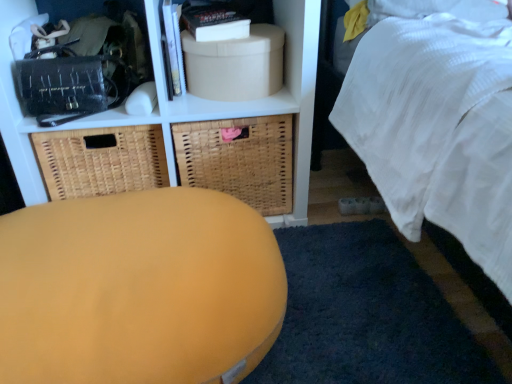
Based on the photo, in order to face woven brown basket at left, the 2th basket positioned from the right, should I rotate leftwards or rightwards?

To align with it, rotate left about 18.414°.

What do you see at coordinates (366, 315) in the screenshot?
I see `soft blue carpet at lower center` at bounding box center [366, 315].

The width and height of the screenshot is (512, 384). What do you see at coordinates (138, 289) in the screenshot? I see `matte yellow ottoman at center` at bounding box center [138, 289].

What is the approximate width of woven brown basket at center, the first basket viewed from the right?

woven brown basket at center, the first basket viewed from the right, is 36.87 centimeters in width.

At what (x,y) coordinates should I click in order to perform the action: click on woven brown basket at left, the first basket in the left-to-right sequence. Please return your answer as a coordinate pair (x, y). The image size is (512, 384). Looking at the image, I should click on (101, 160).

Is matte yellow ottoman at center not within woven brown basket at left, the 2th basket positioned from the right?

That's correct, matte yellow ottoman at center is outside of woven brown basket at left, the 2th basket positioned from the right.

Is point (117, 211) positioned in front of point (76, 131)?

Yes, it is.

Which of these two, matte yellow ottoman at center or woven brown basket at left, the 2th basket positioned from the right, is smaller?

With smaller size is woven brown basket at left, the 2th basket positioned from the right.

Which of these two, matte black book at upper center or woven brown basket at left, the 2th basket positioned from the right, stands shorter?

matte black book at upper center is shorter.

Considering the positions of point (234, 28) and point (51, 150), is point (234, 28) closer or farther from the camera than point (51, 150)?

Clearly, point (234, 28) is more distant from the camera than point (51, 150).

From the picture: Is matte black book at upper center facing towards woven brown basket at left, the first basket in the left-to-right sequence?

No, matte black book at upper center is not aimed at woven brown basket at left, the first basket in the left-to-right sequence.

Is matte black book at upper center located outside woven brown basket at left, the first basket in the left-to-right sequence?

Absolutely, matte black book at upper center is external to woven brown basket at left, the first basket in the left-to-right sequence.

Is woven brown basket at left, the 2th basket positioned from the right, not within matte white shelf at upper center?

That's incorrect, woven brown basket at left, the 2th basket positioned from the right, is not completely outside matte white shelf at upper center.

From a real-world perspective, is woven brown basket at left, the first basket in the left-to-right sequence, physically below matte white shelf at upper center?

Yes, from a real-world perspective, woven brown basket at left, the first basket in the left-to-right sequence, is beneath matte white shelf at upper center.

Which is more to the right, woven brown basket at left, the first basket in the left-to-right sequence, or matte white shelf at upper center?

Positioned to the right is matte white shelf at upper center.

Does woven brown basket at left, the first basket in the left-to-right sequence, have a greater width compared to matte white shelf at upper center?

Incorrect, the width of woven brown basket at left, the first basket in the left-to-right sequence, does not surpass that of matte white shelf at upper center.

How many degrees apart are the facing directions of matte white shelf at upper center and beige cardboard box at upper center?

The angle between the facing direction of matte white shelf at upper center and the facing direction of beige cardboard box at upper center is 3.93 degrees.

From the image's perspective, is matte white shelf at upper center below beige cardboard box at upper center?

Yes, from the image's perspective, matte white shelf at upper center is beneath beige cardboard box at upper center.

In the image, is matte white shelf at upper center on the left side or the right side of beige cardboard box at upper center?

Based on their positions, matte white shelf at upper center is located to the left of beige cardboard box at upper center.

Between matte white shelf at upper center and beige cardboard box at upper center, which one has larger size?

Bigger between the two is matte white shelf at upper center.

The width and height of the screenshot is (512, 384). In order to click on shelf located on the left of beige cardboard box at upper center in this screenshot , I will do point(244,102).

Looking at this image, which is nearer, (275, 49) or (302, 110)?

Clearly, point (275, 49) is more distant from the camera than point (302, 110).

Looking at this image, is beige cardboard box at upper center at the right side of matte white shelf at upper center?

Correct, you'll find beige cardboard box at upper center to the right of matte white shelf at upper center.

In the scene shown: Who is more distant, matte black book at upper center or beige cardboard box at upper center?

matte black book at upper center is behind.

Considering the positions of point (193, 17) and point (258, 30), is point (193, 17) closer or farther from the camera than point (258, 30)?

Point (193, 17) is farther from the camera than point (258, 30).

Considering the sizes of matte black book at upper center and beige cardboard box at upper center in the image, is matte black book at upper center wider or thinner than beige cardboard box at upper center?

Considering their sizes, matte black book at upper center looks slimmer than beige cardboard box at upper center.

Find the location of `book on the left of beige cardboard box at upper center`. book on the left of beige cardboard box at upper center is located at coordinates (215, 23).

Does soft blue carpet at lower center turn towards matte white shelf at upper center?

No, soft blue carpet at lower center is not turned towards matte white shelf at upper center.

Can you tell me how much soft blue carpet at lower center and matte white shelf at upper center differ in facing direction?

The angle between the facing direction of soft blue carpet at lower center and the facing direction of matte white shelf at upper center is 89.7 degrees.

From a real-world perspective, between soft blue carpet at lower center and matte white shelf at upper center, who is vertically higher?

matte white shelf at upper center, from a real-world perspective.

Can you confirm if soft blue carpet at lower center is smaller than matte white shelf at upper center?

Yes.

Which basket is the 1st one when counting from the back of the matte yellow ottoman at center? Please provide its 2D coordinates.

[(101, 160)]

Identify the location of book lying on the right of woven brown basket at left, the first basket in the left-to-right sequence. (215, 23).

Estimate the real-world distances between objects in this image. Which object is further from woven brown basket at left, the first basket in the left-to-right sequence, matte yellow ottoman at center or soft blue carpet at lower center?

soft blue carpet at lower center is further to woven brown basket at left, the first basket in the left-to-right sequence.

Which object lies further to the anchor point matte yellow ottoman at center, soft blue carpet at lower center or matte black book at upper center?

Among the two, matte black book at upper center is located further to matte yellow ottoman at center.

Estimate the real-world distances between objects in this image. Which object is closer to matte white shelf at upper center, matte black book at upper center or matte yellow ottoman at center?

matte black book at upper center lies closer to matte white shelf at upper center than the other object.

From the image, which object appears to be nearer to matte yellow ottoman at center, soft blue carpet at lower center or woven brown basket at left, the 2th basket positioned from the right?

Based on the image, soft blue carpet at lower center appears to be nearer to matte yellow ottoman at center.

Which object lies nearer to the anchor point beige cardboard box at upper center, matte white shelf at upper center or matte black book at upper center?

matte black book at upper center.

Estimate the real-world distances between objects in this image. Which object is further from woven brown basket at left, the 2th basket positioned from the right, soft blue carpet at lower center or matte yellow ottoman at center?

Among the two, soft blue carpet at lower center is located further to woven brown basket at left, the 2th basket positioned from the right.

Which object lies further to the anchor point soft blue carpet at lower center, beige cardboard box at upper center or matte black book at upper center?

Based on the image, matte black book at upper center appears to be further to soft blue carpet at lower center.

Looking at this image, looking at the image, which one is located closer to beige cardboard box at upper center, matte black book at upper center or soft blue carpet at lower center?

matte black book at upper center is positioned closer to the anchor beige cardboard box at upper center.

I want to click on shelf located between matte yellow ottoman at center and woven brown basket at left, the 2th basket positioned from the right, in the depth direction, so click(244, 102).

Where is `storage box between matte yellow ottoman at center and woven brown basket at left, the 2th basket positioned from the right, in the front-back direction`? This screenshot has height=384, width=512. storage box between matte yellow ottoman at center and woven brown basket at left, the 2th basket positioned from the right, in the front-back direction is located at coordinates (234, 65).

Where is `storage box between woven brown basket at left, the first basket in the left-to-right sequence, and soft blue carpet at lower center from left to right`? The height and width of the screenshot is (384, 512). storage box between woven brown basket at left, the first basket in the left-to-right sequence, and soft blue carpet at lower center from left to right is located at coordinates (234, 65).

Where is `mat that lies between matte black book at upper center and matte yellow ottoman at center from top to bottom`? This screenshot has width=512, height=384. mat that lies between matte black book at upper center and matte yellow ottoman at center from top to bottom is located at coordinates (366, 315).